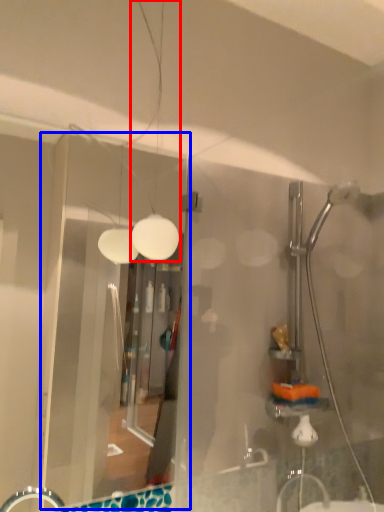
Question: Which of the following is the closest to the observer, light fixture (highlighted by a red box) or glass door (highlighted by a blue box)?

Choices:
 (A) light fixture
 (B) glass door

Answer: (B)